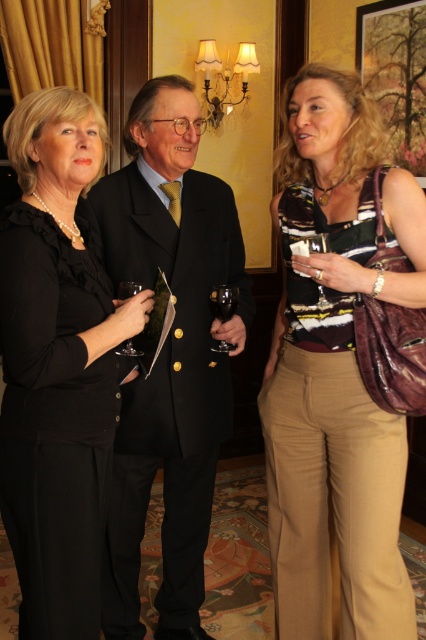
From the picture: Between striped jersey at center and black wool suit at center, which one has more height?

With more height is black wool suit at center.

Between point (302, 310) and point (209, 637), which one is positioned in front?

Positioned in front is point (302, 310).

Image resolution: width=426 pixels, height=640 pixels. I want to click on striped jersey at center, so click(336, 369).

Between shiny black glass at center and transparent glass at center, which one is positioned lower?

Positioned lower is transparent glass at center.

Can you confirm if shiny black glass at center is positioned to the right of transparent glass at center?

Indeed, shiny black glass at center is positioned on the right side of transparent glass at center.

Is point (227, 342) positioned after point (129, 291)?

That is True.

Image resolution: width=426 pixels, height=640 pixels. Find the location of `shiny black glass at center`. shiny black glass at center is located at coordinates (224, 301).

This screenshot has width=426, height=640. In order to click on black satin dress at left in this screenshot , I will do `click(57, 365)`.

Based on the photo, can you confirm if black satin dress at left is taller than shiny black glass at center?

Correct, black satin dress at left is much taller as shiny black glass at center.

Between point (17, 497) and point (216, 285), which one is positioned behind?

The point (216, 285) is behind.

The width and height of the screenshot is (426, 640). In order to click on black satin dress at left in this screenshot , I will do `click(57, 365)`.